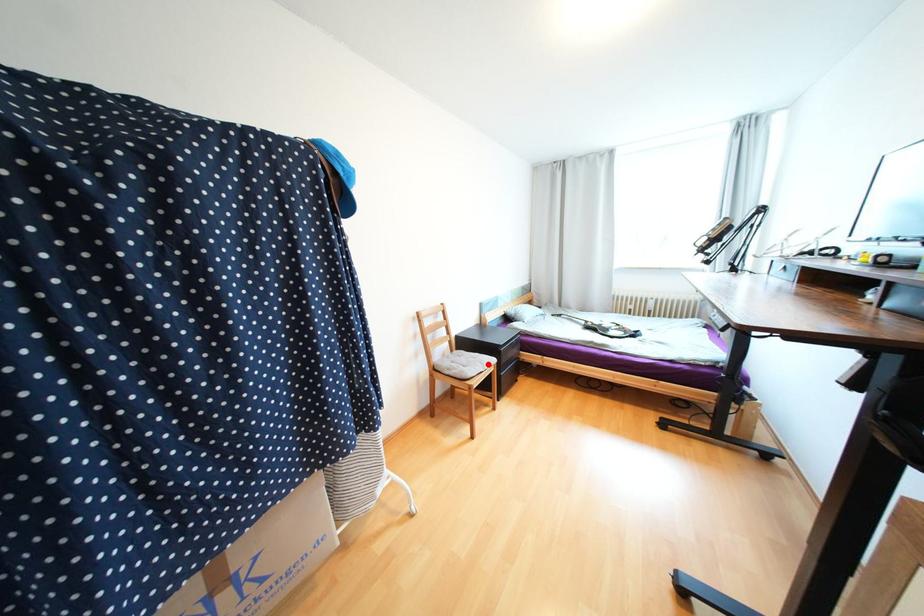
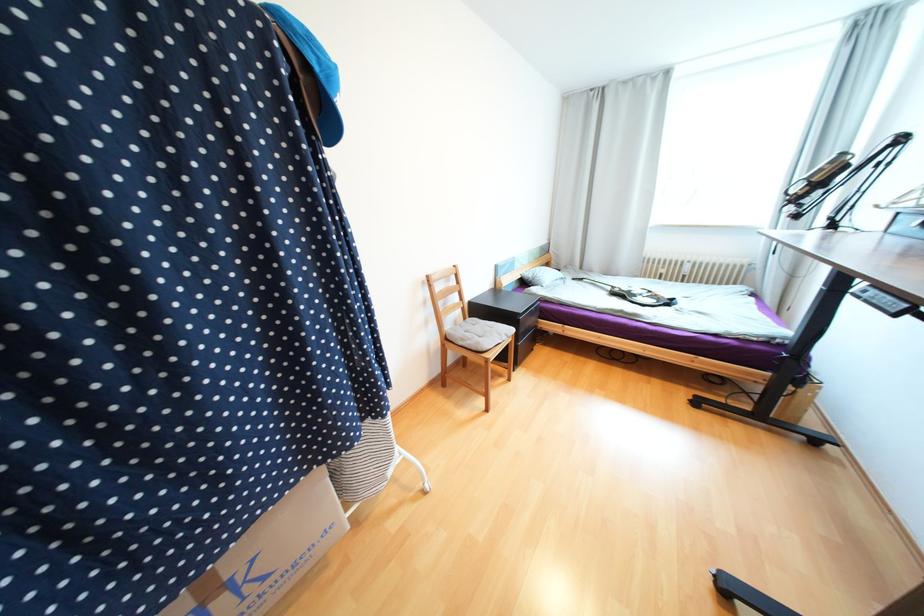
Find the pixel in the second image that matches the highlighted location in the first image.

(505, 334)